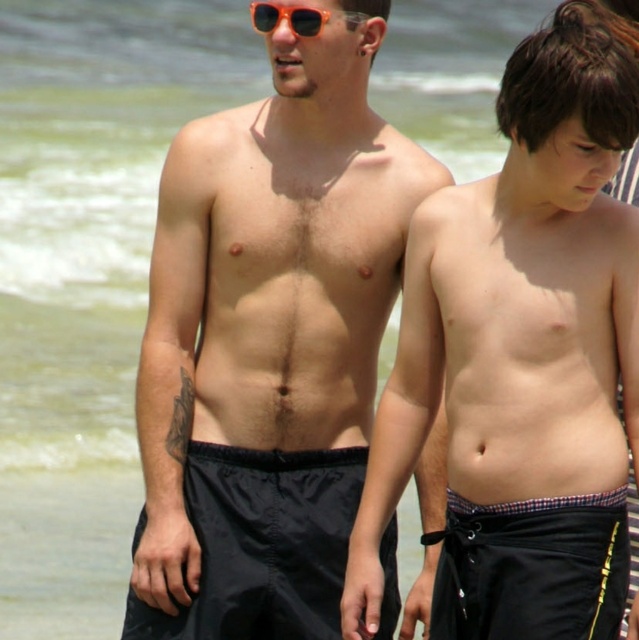
Is the position of plaid fabric shorts at lower center more distant than that of orange plastic sunglasses at upper center?

No, it is in front of orange plastic sunglasses at upper center.

Locate an element on the screen. plaid fabric shorts at lower center is located at coordinates (532, 568).

Locate an element on the screen. plaid fabric shorts at lower center is located at coordinates (532, 568).

Is smooth skin torso at center taller than orange plastic sunglasses at upper center?

No.

Where is `smooth skin torso at center`? This screenshot has height=640, width=639. smooth skin torso at center is located at coordinates point(521,356).

In the scene shown: Who is more distant from viewer, (387, 481) or (263, 4)?

Positioned behind is point (263, 4).

This screenshot has height=640, width=639. In order to click on smooth skin torso at center in this screenshot , I will do `click(521, 356)`.

Does matte black shorts at center appear on the left side of smooth skin torso at center?

Yes, matte black shorts at center is to the left of smooth skin torso at center.

Is matte black shorts at center above smooth skin torso at center?

Yes, matte black shorts at center is above smooth skin torso at center.

Is point (392, 128) closer to viewer compared to point (592, 401)?

That is False.

Where is `matte black shorts at center`? matte black shorts at center is located at coordinates (268, 340).